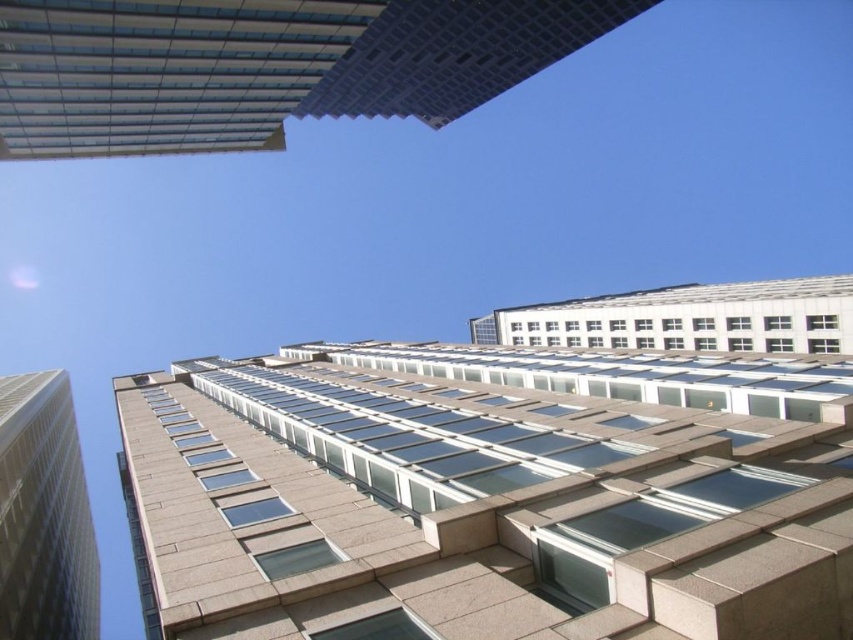
Does glassy concrete skyscraper at upper left appear on the right side of beige stone tower at left?

Yes, glassy concrete skyscraper at upper left is to the right of beige stone tower at left.

Can you confirm if glassy concrete skyscraper at upper left is positioned to the left of beige stone tower at left?

Incorrect, glassy concrete skyscraper at upper left is not on the left side of beige stone tower at left.

The height and width of the screenshot is (640, 853). Find the location of `glassy concrete skyscraper at upper left`. glassy concrete skyscraper at upper left is located at coordinates (263, 65).

At what (x,y) coordinates should I click in order to perform the action: click on glassy concrete skyscraper at upper left. Please return your answer as a coordinate pair (x, y). The height and width of the screenshot is (640, 853). Looking at the image, I should click on (263, 65).